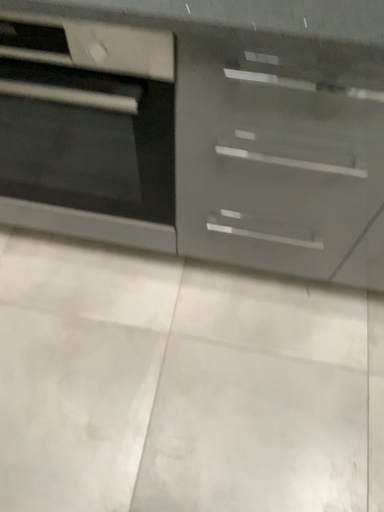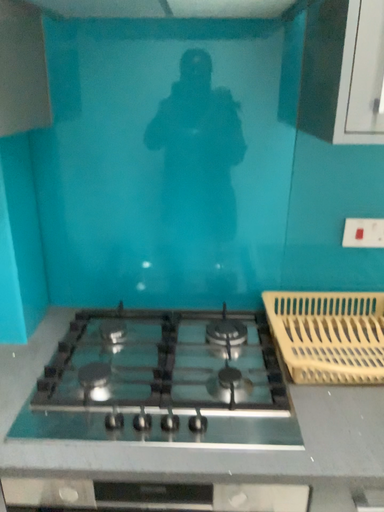
Question: How did the camera likely rotate when shooting the video?

Choices:
 (A) rotated downward
 (B) rotated upward

Answer: (B)